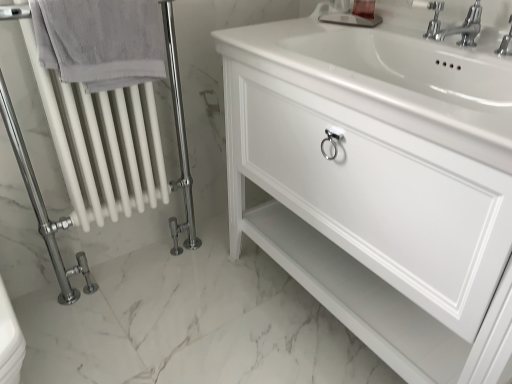
Locate an element on the screen. This screenshot has height=384, width=512. vacant region below white glossy radiator at left (from a real-world perspective) is located at coordinates (136, 279).